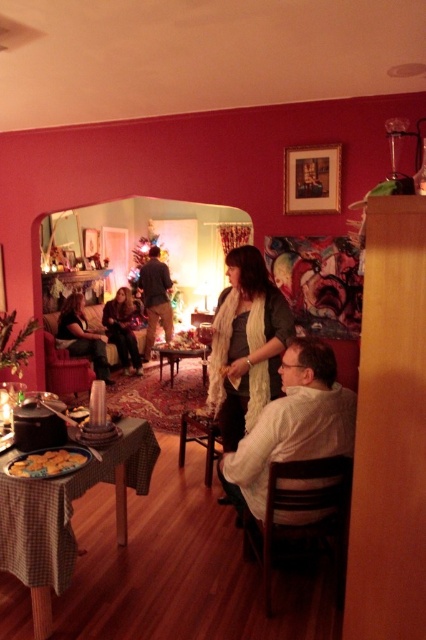
Question: Is the position of green checkered tablecloth at lower left less distant than that of white matte shirt at lower right?

Choices:
 (A) no
 (B) yes

Answer: (B)

Question: Which object appears farthest from the camera in this image?

Choices:
 (A) brown wooden chair at lower right
 (B) woodenwoodentable at center

Answer: (B)

Question: Considering the relative positions of matte black jacket at left and matte black sweater at center in the image provided, where is matte black jacket at left located with respect to matte black sweater at center?

Choices:
 (A) right
 (B) left

Answer: (B)

Question: Which point appears farthest from the camera in this image?

Choices:
 (A) 118,317
 (B) 54,380
 (C) 232,323
 (D) 314,380

Answer: (A)

Question: Can you confirm if knitted scarf at center is wider than brown wooden chair at lower right?

Choices:
 (A) yes
 (B) no

Answer: (B)

Question: Which point appears farthest from the camera in this image?

Choices:
 (A) (152, 337)
 (B) (88, 349)
 (C) (16, 468)
 (D) (294, 392)

Answer: (A)